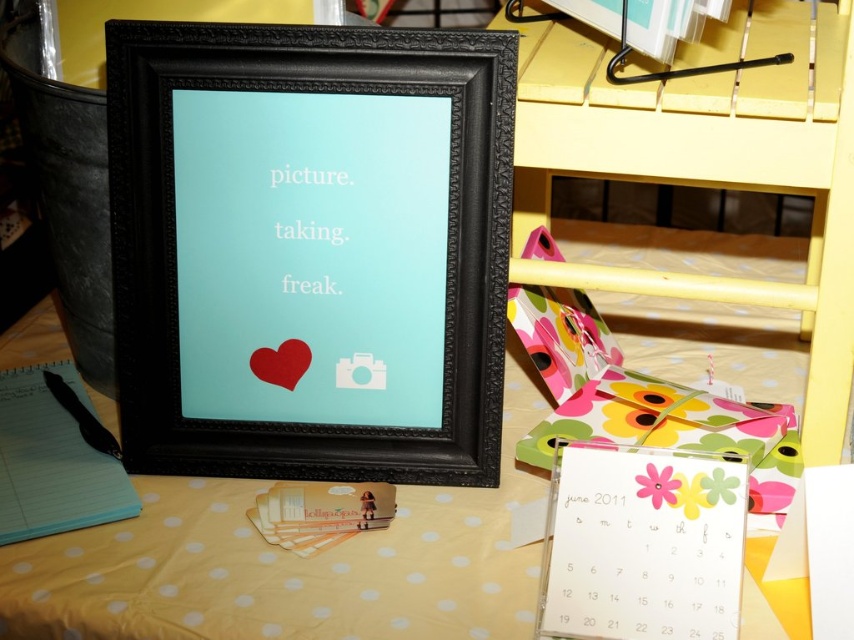
You are an artist who wants to draw on the yellow dotted fabric at center. You have a black matte pen at lower left. Can you reach the fabric without moving the pen?

The yellow dotted fabric at center is positioned under the black matte pen at lower left, so the pen is already on top of the fabric. Therefore, you can draw on the fabric using the black matte pen at lower left without needing to move it.

What is located at the coordinates point (290,563)?

The point (290,563) indicates yellow dotted fabric at center.

You are a photographer who wants to take a photo of the matte black frame at center and the yellow wood bunk bed at lower right. Which object should you focus on first if you want to capture both in a single shot without moving the camera?

The matte black frame at center is not as tall as the yellow wood bunk bed at lower right, so you should focus on the yellow wood bunk bed at lower right first to ensure it fits within the frame.